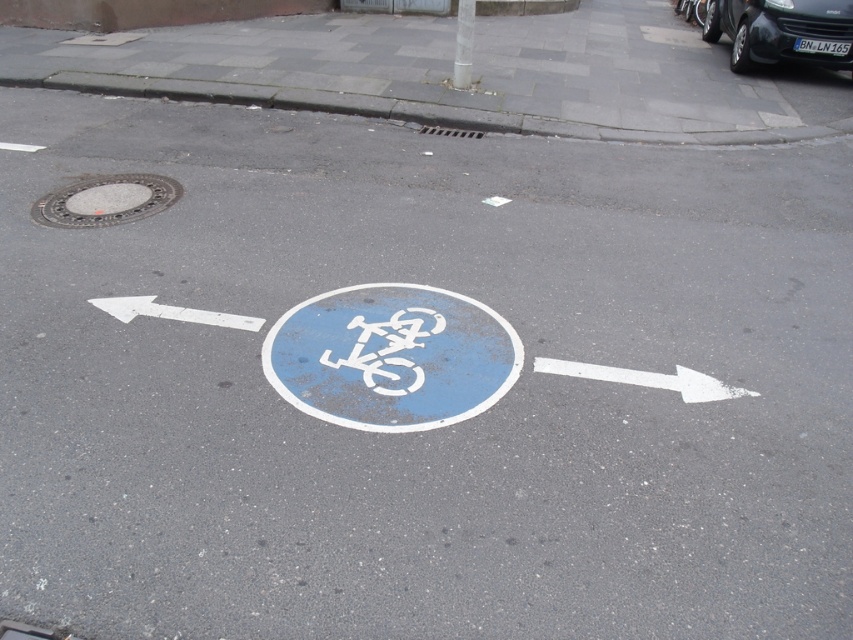
You are a delivery driver who needs to park your vehicle on the street. The parking spot is marked by the point at coordinates point (387, 349). However, there is a bicycle lane indicated by a sign. Can you safely park your vehicle there without violating traffic rules?

The point (387, 349) marks the white matte bicycle symbol at center, which indicates a shared bicycle lane. Parking here would obstruct the bicycle lane, so it is not allowed.

You are a delivery person who needs to park your electric scooter. The scooter requires a minimum of 15 feet of space to park safely. You see the white painted bike lane at center and the metallic pole at upper center. Can you park your scooter between these two objects?

The white painted bike lane at center is 16.12 feet from the metallic pole at upper center, which is more than the required 15 feet. Therefore, you can park your scooter between these two objects safely.